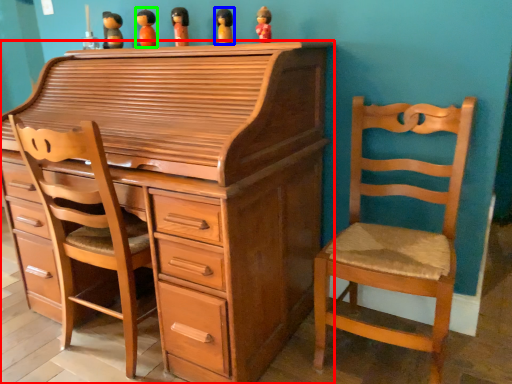
Question: Which is farther away from chest of drawers (highlighted by a red box)? toy (highlighted by a blue box) or toy (highlighted by a green box)?

Choices:
 (A) toy
 (B) toy

Answer: (B)